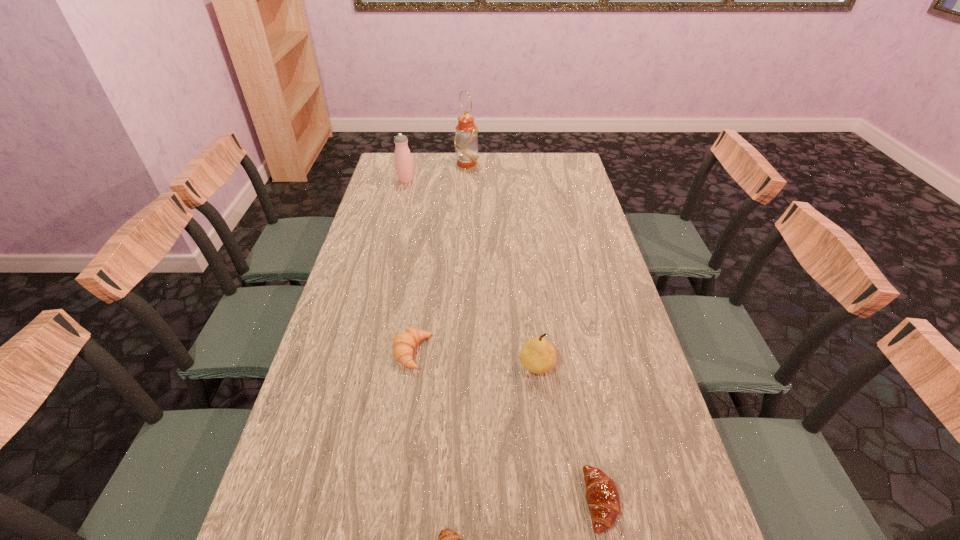
What are the coordinates of `the tallest object` in the screenshot? It's located at (466, 136).

Locate an element on the screen. This screenshot has width=960, height=540. oil lamp is located at coordinates (466, 136).

This screenshot has height=540, width=960. In order to click on thermos bottle in this screenshot , I will do `click(403, 161)`.

Locate an element on the screen. the leftmost object is located at coordinates (x=403, y=161).

What are the coordinates of `the fifth object from left to right` in the screenshot? It's located at (538, 355).

What are the coordinates of `pear` in the screenshot? It's located at (538, 355).

Where is `the farthest crescent roll`? The height and width of the screenshot is (540, 960). the farthest crescent roll is located at coordinates (404, 343).

This screenshot has width=960, height=540. Find the location of `the leftmost crescent roll`. the leftmost crescent roll is located at coordinates (404, 343).

Locate an element on the screen. The height and width of the screenshot is (540, 960). the rightmost crescent roll is located at coordinates (602, 495).

Where is `free space located on the right of the farthest object`? The height and width of the screenshot is (540, 960). free space located on the right of the farthest object is located at coordinates (548, 164).